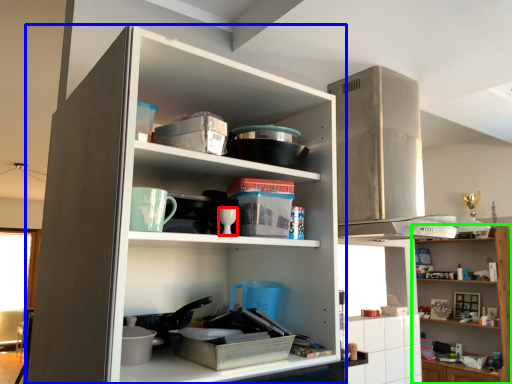
Question: Considering the real-world distances, which object is farthest from tableware (highlighted by a red box)? cupboard (highlighted by a blue box) or shelf (highlighted by a green box)?

Choices:
 (A) cupboard
 (B) shelf

Answer: (B)